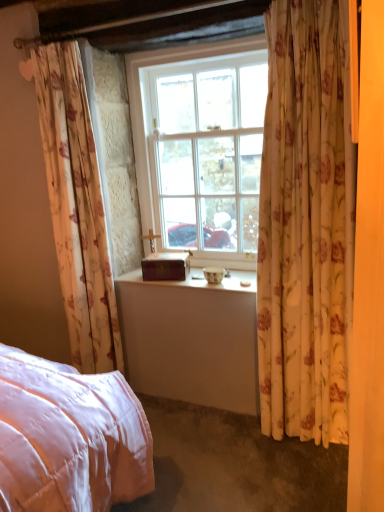
The height and width of the screenshot is (512, 384). In order to click on free space above wooden box at center (from a real-world perspective) in this screenshot , I will do `click(166, 256)`.